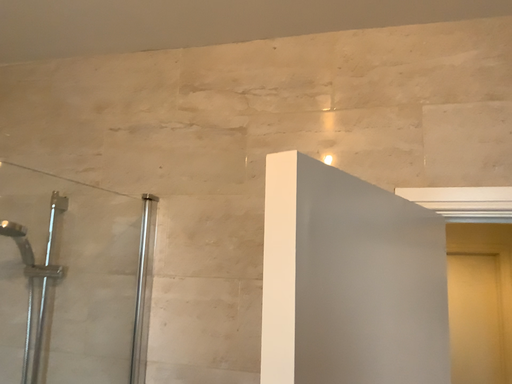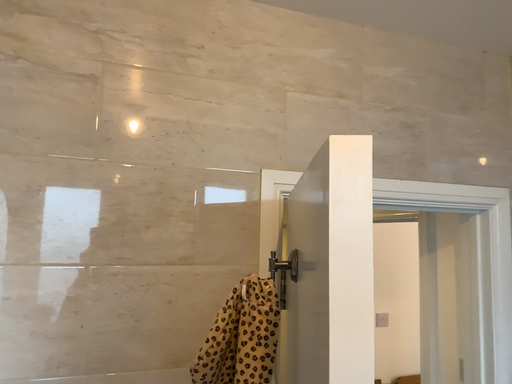
Question: How did the camera likely rotate when shooting the video?

Choices:
 (A) rotated left
 (B) rotated right

Answer: (B)